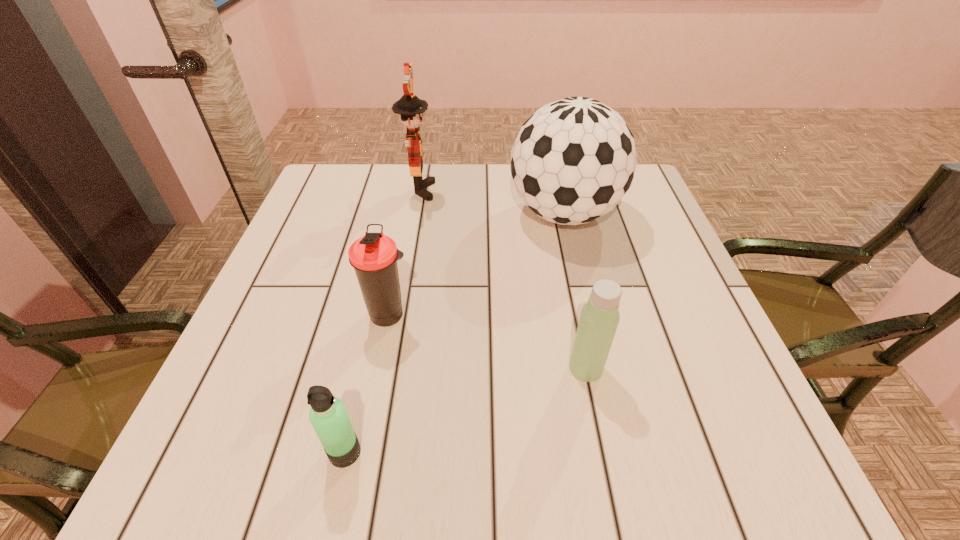
The height and width of the screenshot is (540, 960). Find the location of `free area in between the rightmost thermos bottle and the nearest object`. free area in between the rightmost thermos bottle and the nearest object is located at coordinates (466, 410).

Locate an element on the screen. free space between the nutcracker and the third nearest object is located at coordinates (404, 253).

At what (x,y) coordinates should I click in order to perform the action: click on object that stands as the third closest to the nearest thermos bottle. Please return your answer as a coordinate pair (x, y). This screenshot has width=960, height=540. Looking at the image, I should click on (573, 160).

Select which object is the third closest to the farthest thermos bottle. Please provide its 2D coordinates. Your answer should be formatted as a tuple, i.e. [(x, y)], where the tuple contains the x and y coordinates of a point satisfying the conditions above.

[(411, 108)]

This screenshot has width=960, height=540. In order to click on thermos bottle that is the nearest to the farthest thermos bottle in this screenshot , I will do `click(328, 416)`.

Locate which thermos bottle ranks third in proximity to the soccer ball. Please provide its 2D coordinates. Your answer should be formatted as a tuple, i.e. [(x, y)], where the tuple contains the x and y coordinates of a point satisfying the conditions above.

[(328, 416)]

The image size is (960, 540). Find the location of `vacant area that satisfies the following two spatial constraints: 1. on the back side of the third farthest object; 2. on the right side of the soccer ball`. vacant area that satisfies the following two spatial constraints: 1. on the back side of the third farthest object; 2. on the right side of the soccer ball is located at coordinates (409, 214).

This screenshot has width=960, height=540. Identify the location of free space that satisfies the following two spatial constraints: 1. on the back side of the soccer ball; 2. on the front-facing side of the nutcracker. (559, 190).

Find the location of `free space that satisfies the following two spatial constraints: 1. on the front-facing side of the nutcracker; 2. on the right side of the second nearest thermos bottle`. free space that satisfies the following two spatial constraints: 1. on the front-facing side of the nutcracker; 2. on the right side of the second nearest thermos bottle is located at coordinates (388, 368).

In order to click on free spot that satisfies the following two spatial constraints: 1. on the back side of the nearest thermos bottle; 2. on the right side of the fourth farthest object in this screenshot , I will do [364, 368].